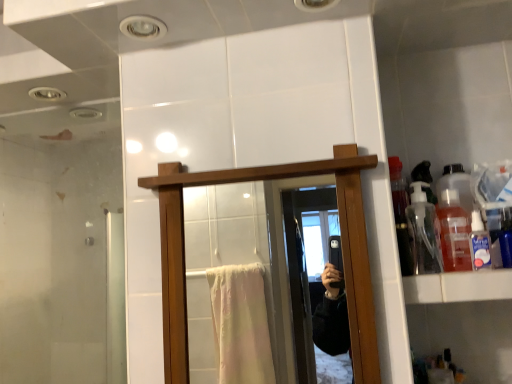
Question: Is clear plastic bottle at upper right beside translucent plastic bottle at upper right, arranged as the 2th bottle when viewed from the left?

Choices:
 (A) yes
 (B) no

Answer: (A)

Question: From the image's perspective, does clear plastic bottle at upper right appear higher than translucent plastic bottle at upper right, arranged as the 2th bottle when viewed from the left?

Choices:
 (A) yes
 (B) no

Answer: (B)

Question: Is clear plastic bottle at upper right aimed at translucent plastic bottle at upper right, the first bottle in the right-to-left sequence?

Choices:
 (A) no
 (B) yes

Answer: (A)

Question: From the image's perspective, would you say clear plastic bottle at upper right is shown under translucent plastic bottle at upper right, the first bottle in the right-to-left sequence?

Choices:
 (A) no
 (B) yes

Answer: (B)

Question: Is clear plastic bottle at upper right further to camera compared to translucent plastic bottle at upper right, the first bottle in the right-to-left sequence?

Choices:
 (A) no
 (B) yes

Answer: (A)

Question: Does point (461, 292) appear closer or farther from the camera than point (268, 327)?

Choices:
 (A) closer
 (B) farther

Answer: (A)

Question: From a real-world perspective, is white glossy cabinet at right physically located above or below wooden mirror at center?

Choices:
 (A) below
 (B) above

Answer: (A)

Question: Which is correct: white glossy cabinet at right is inside wooden mirror at center, or outside of it?

Choices:
 (A) outside
 (B) inside

Answer: (A)

Question: Considering the positions of white glossy cabinet at right and wooden mirror at center in the image, is white glossy cabinet at right taller or shorter than wooden mirror at center?

Choices:
 (A) short
 (B) tall

Answer: (A)

Question: Does point (259, 380) appear closer or farther from the camera than point (457, 210)?

Choices:
 (A) farther
 (B) closer

Answer: (A)

Question: Is wooden mirror at center in front of or behind translucent plastic bottle at upper right, arranged as the 2th bottle when viewed from the left, in the image?

Choices:
 (A) front
 (B) behind

Answer: (A)

Question: Is wooden mirror at center inside the boundaries of translucent plastic bottle at upper right, arranged as the 2th bottle when viewed from the left, or outside?

Choices:
 (A) inside
 (B) outside

Answer: (B)

Question: In terms of height, does wooden mirror at center look taller or shorter compared to translucent plastic bottle at upper right, the first bottle in the right-to-left sequence?

Choices:
 (A) tall
 (B) short

Answer: (A)

Question: Based on their sizes in the image, would you say clear plastic bottle at upper right is bigger or smaller than white glossy cabinet at right?

Choices:
 (A) big
 (B) small

Answer: (B)

Question: Is point (479, 216) positioned closer to the camera than point (479, 299)?

Choices:
 (A) closer
 (B) farther

Answer: (B)